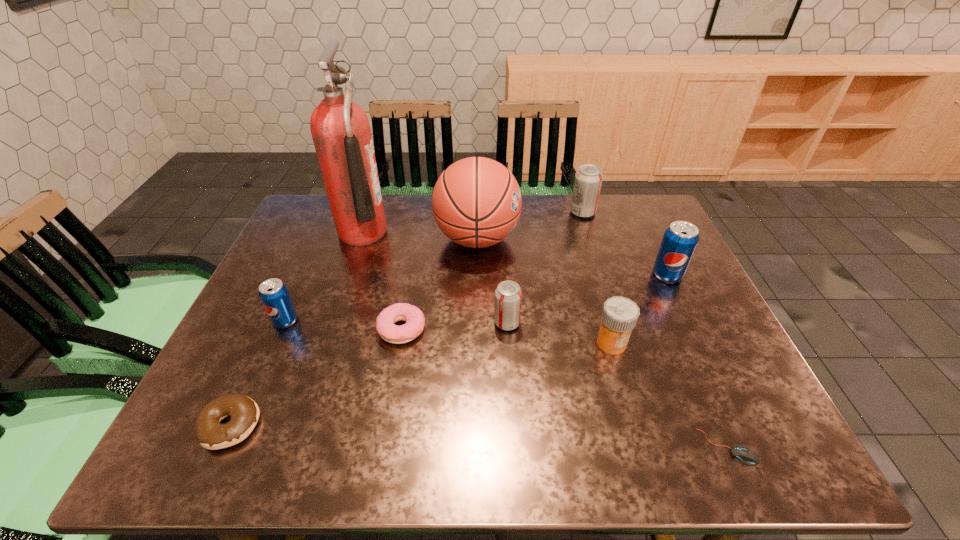
Identify the location of the third soda can from right to left. This screenshot has width=960, height=540. (508, 296).

Find the location of a particular element. The height and width of the screenshot is (540, 960). the smaller gray soda can is located at coordinates (508, 296).

Locate an element on the screen. This screenshot has height=540, width=960. medicine is located at coordinates tap(619, 316).

This screenshot has width=960, height=540. Identify the location of pink doughnut. (413, 316).

Locate an element on the screen. This screenshot has height=540, width=960. the right doughnut is located at coordinates (413, 316).

I want to click on brown doughnut, so pos(244,412).

Where is `the nearer doughnut`? This screenshot has height=540, width=960. the nearer doughnut is located at coordinates (244, 412).

This screenshot has width=960, height=540. Identify the location of mouse. (746, 455).

Where is `the shortest object`? This screenshot has width=960, height=540. the shortest object is located at coordinates (746, 455).

Locate an element on the screen. The width and height of the screenshot is (960, 540). vacant region located on the front of the red fire extinguisher near the operation label is located at coordinates (452, 232).